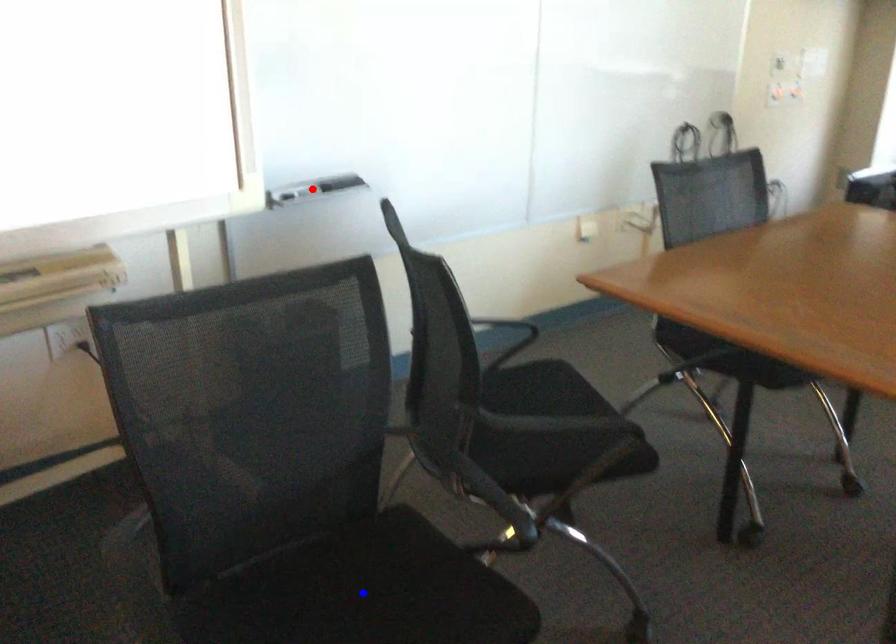
Question: Which of the two points in the image is closer to the camera?

Choices:
 (A) Blue point is closer.
 (B) Red point is closer.

Answer: (A)